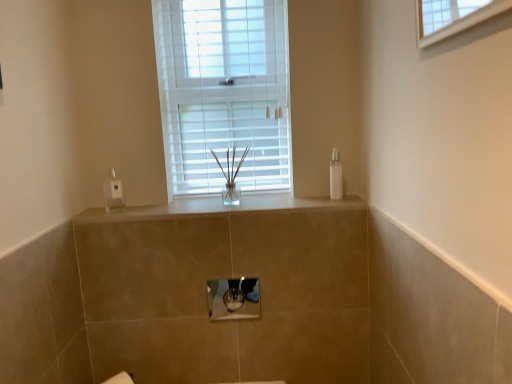
Where is `free space that is to the left of clear plastic soap dispenser at left`? free space that is to the left of clear plastic soap dispenser at left is located at coordinates (88, 211).